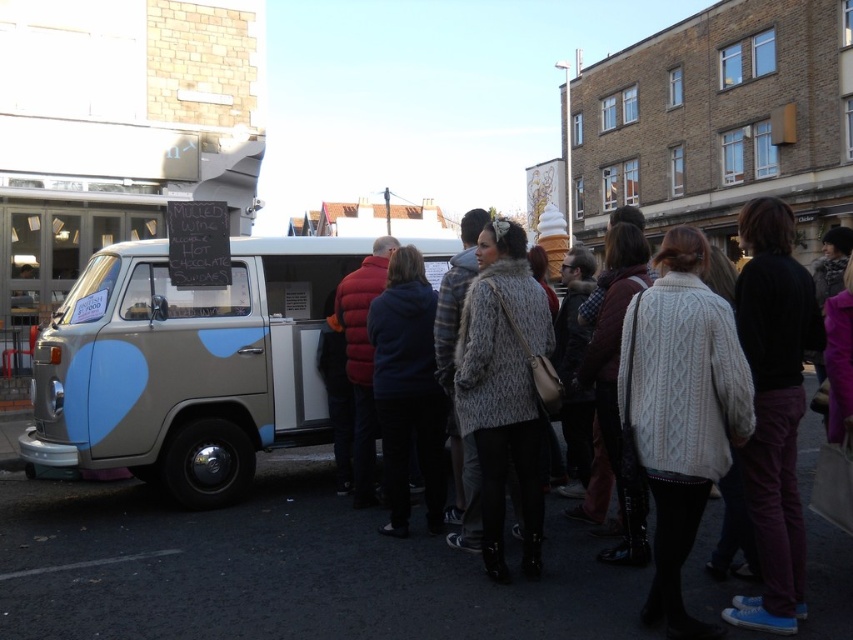
Question: Which of the following is the farthest from the observer?

Choices:
 (A) knitted sweater at center
 (B) matte beige van at center

Answer: (B)

Question: Considering the real-world distances, which object is farthest from the black asphalt at lower left?

Choices:
 (A) matte beige van at center
 (B) knitted sweater at center

Answer: (B)

Question: Is matte beige van at center to the left of knitted sweater at center from the viewer's perspective?

Choices:
 (A) yes
 (B) no

Answer: (A)

Question: Does knitted sweater at center have a larger size compared to black asphalt at lower left?

Choices:
 (A) no
 (B) yes

Answer: (B)

Question: Among these objects, which one is farthest from the camera?

Choices:
 (A) matte beige van at center
 (B) black asphalt at lower left

Answer: (A)

Question: Does matte beige van at center come in front of black asphalt at lower left?

Choices:
 (A) yes
 (B) no

Answer: (B)